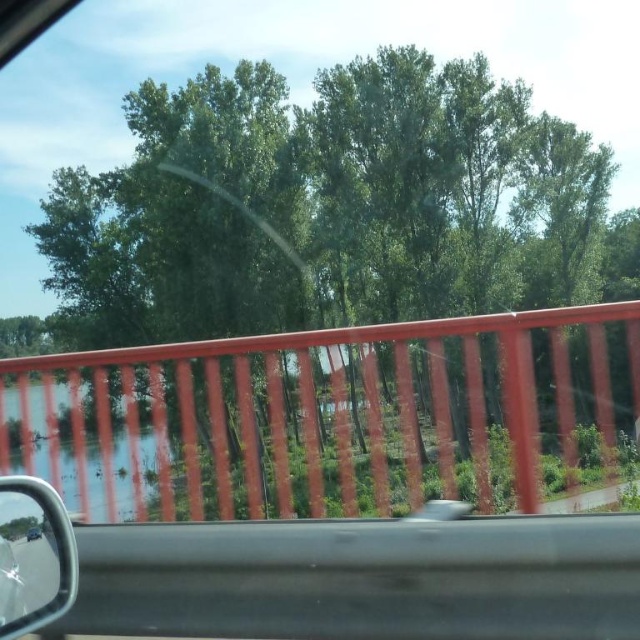
Does point (358, 381) lie behind point (52, 486)?

Yes, point (358, 381) is farther from viewer.

Can you confirm if smooth orange railing at center is positioned above shiny black mirror at lower left?

No, smooth orange railing at center is not above shiny black mirror at lower left.

Who is more forward, (88, 499) or (42, 496)?

Point (42, 496) is more forward.

What are the coordinates of `smooth orange railing at center` in the screenshot? It's located at (333, 419).